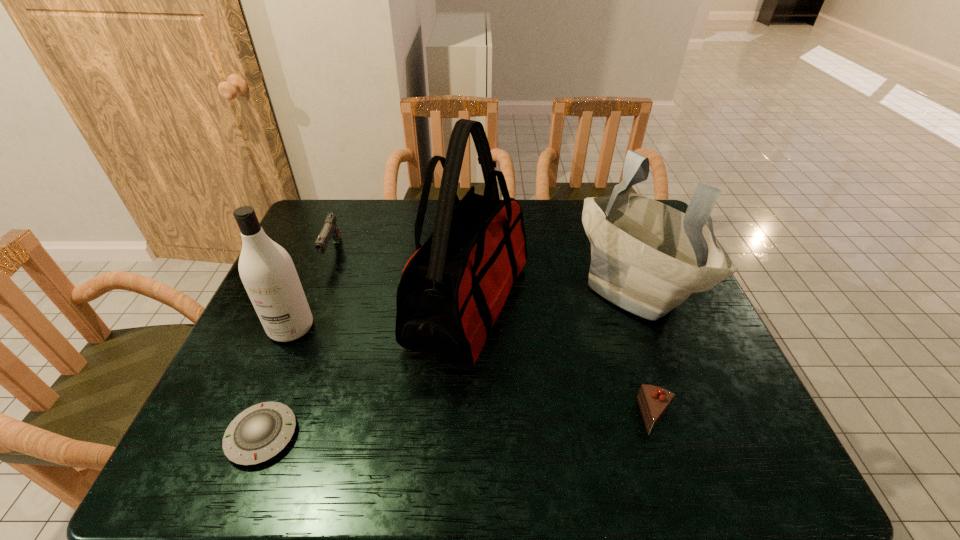
Image resolution: width=960 pixels, height=540 pixels. In order to click on the tallest object in this screenshot , I will do `click(453, 288)`.

Identify the location of the third object from right to left. The width and height of the screenshot is (960, 540). (x=453, y=288).

Find the location of a particular element. The height and width of the screenshot is (540, 960). shopping bag is located at coordinates (647, 258).

The height and width of the screenshot is (540, 960). Find the location of `shampoo`. shampoo is located at coordinates (267, 271).

Where is `gun`? gun is located at coordinates (330, 230).

Locate an element on the screen. chocolate cake is located at coordinates (654, 402).

What are the coordinates of `saucer` in the screenshot? It's located at (260, 432).

Locate an element on the screen. The width and height of the screenshot is (960, 540). free space located 0.260m on the back of the third object from right to left is located at coordinates (470, 205).

Locate an element on the screen. free space located on the left of the shopping bag is located at coordinates (467, 287).

Identify the location of free space located on the front-facing side of the shampoo. This screenshot has width=960, height=540. (239, 450).